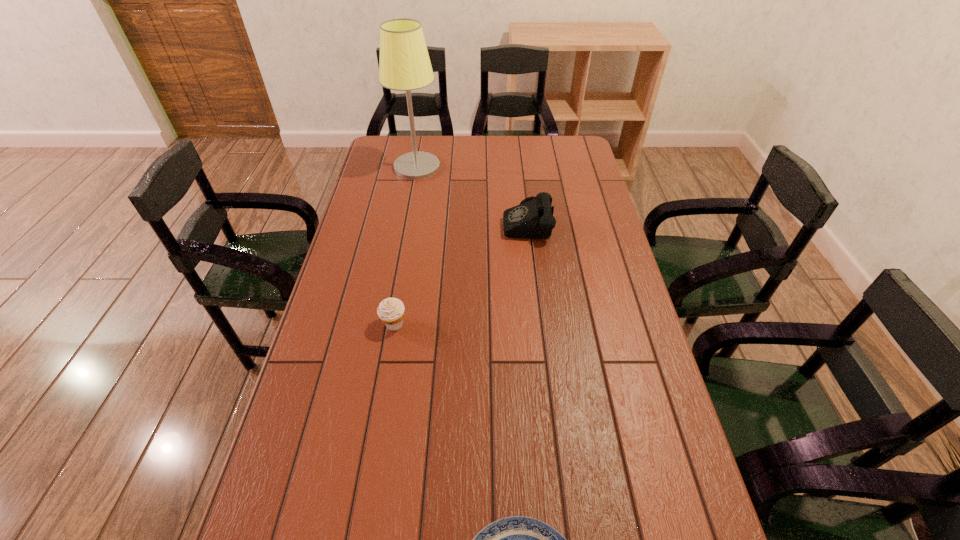
Where is `object that is the third nearest to the muffin`? The height and width of the screenshot is (540, 960). object that is the third nearest to the muffin is located at coordinates (405, 65).

Locate which object ranks in proximity to the farthest object. Please provide its 2D coordinates. Your answer should be formatted as a tuple, i.e. [(x, y)], where the tuple contains the x and y coordinates of a point satisfying the conditions above.

[(534, 219)]